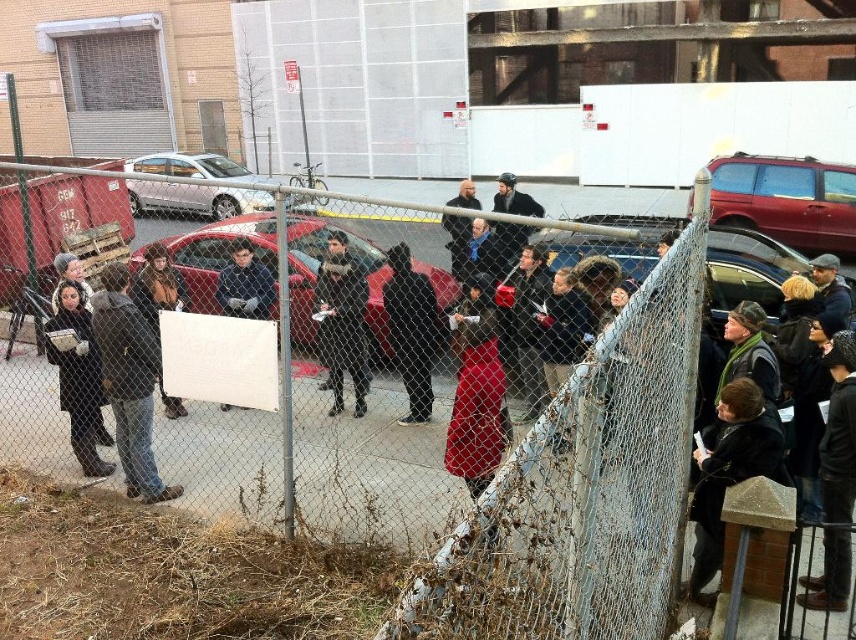
The height and width of the screenshot is (640, 856). What do you see at coordinates (316, 280) in the screenshot?
I see `shiny red car at center` at bounding box center [316, 280].

Can you confirm if shiny red car at center is positioned to the right of white paper at center?

Indeed, shiny red car at center is positioned on the right side of white paper at center.

Is point (369, 317) closer to viewer compared to point (250, 257)?

Yes.

Find the location of a particular element. This screenshot has height=640, width=856. shiny red car at center is located at coordinates (316, 280).

Can you confirm if metallic red suv at upper right is taller than dark gray sweater at lower right?

Correct, metallic red suv at upper right is much taller as dark gray sweater at lower right.

I want to click on metallic red suv at upper right, so click(786, 198).

Identify the location of metallic red suv at upper right. This screenshot has height=640, width=856. (786, 198).

Which is behind, point (137, 305) or point (458, 253)?

Positioned behind is point (137, 305).

Can you confirm if leather jacket at center is bigger than dark gray sweater at center?

No, leather jacket at center is not bigger than dark gray sweater at center.

Is point (143, 298) positioned behind point (449, 205)?

That is False.

This screenshot has height=640, width=856. What are the coordinates of `leather jacket at center` in the screenshot? It's located at 158,285.